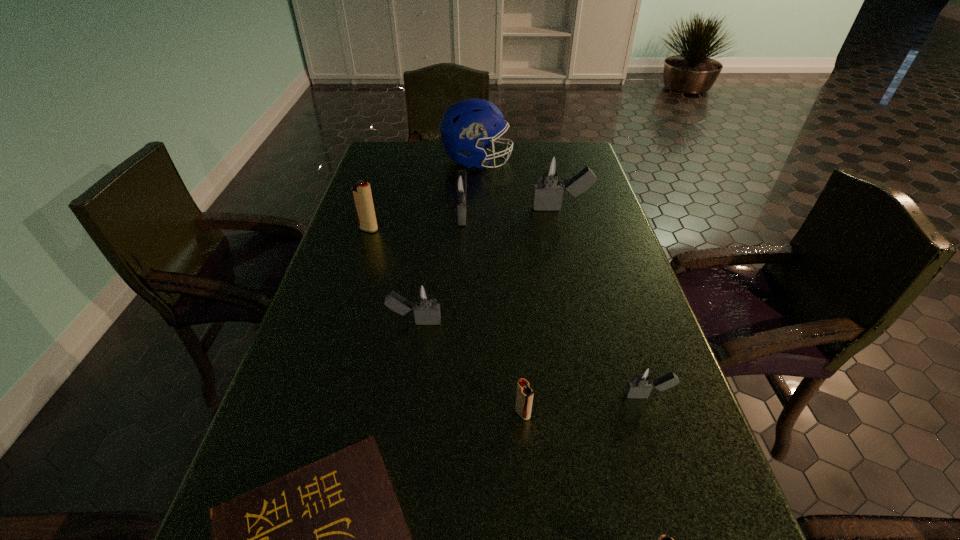
The image size is (960, 540). I want to click on the second red igniter from right to left, so (x=524, y=397).

Where is `the smallest gray igniter`? The image size is (960, 540). the smallest gray igniter is located at coordinates click(643, 379).

What are the coordinates of `free space located on the front-facing side of the farthest object` in the screenshot? It's located at (559, 161).

You are a GUI agent. You are given a task and a screenshot of the screen. Output one action in this format:
    pyautogui.click(x=<x>, y=<y>)
    Task: Click on the vacant region located on the left of the biggest gray igniter
    This screenshot has height=540, width=960.
    Given the screenshot: What is the action you would take?
    pyautogui.click(x=485, y=208)

I want to click on free space located on the back of the leftmost red igniter, so click(383, 185).

I want to click on vacant area located 0.270m on the front of the third smallest gray igniter, so click(x=459, y=294).

Find the location of `free space located 0.130m on the right of the third biggest gray igniter`. free space located 0.130m on the right of the third biggest gray igniter is located at coordinates (500, 322).

At what (x,y) coordinates should I click in order to perform the action: click on free space located 0.240m on the right of the smallest red igniter. Please return your answer as a coordinate pair (x, y). The width and height of the screenshot is (960, 540). Looking at the image, I should click on (662, 414).

Where is `free space located 0.050m on the back of the nearest gray igniter`? Image resolution: width=960 pixels, height=540 pixels. free space located 0.050m on the back of the nearest gray igniter is located at coordinates (637, 364).

Image resolution: width=960 pixels, height=540 pixels. Find the location of `object located at the far edge`. object located at the far edge is located at coordinates (465, 126).